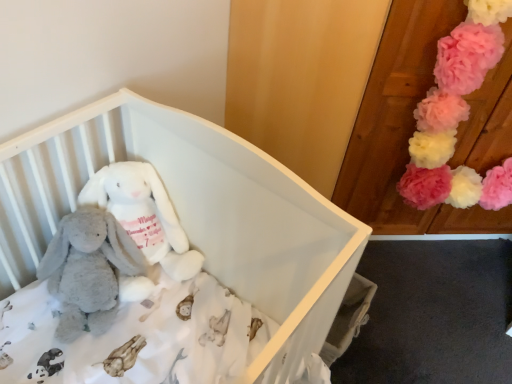
What do you see at coordinates (88, 270) in the screenshot? The width and height of the screenshot is (512, 384). I see `soft gray plush at center, which appears as the third toy when viewed from the right` at bounding box center [88, 270].

What is the approximate width of soft gray plush at center, which appears as the third toy when viewed from the right?

soft gray plush at center, which appears as the third toy when viewed from the right, is 8.77 inches in width.

Where is `fluffy pink pom-poms at upper right, which is the third toy from left to right`? Image resolution: width=512 pixels, height=384 pixels. fluffy pink pom-poms at upper right, which is the third toy from left to right is located at coordinates (457, 116).

At what (x,y) coordinates should I click in order to perform the action: click on soft gray plush at center, the 1th toy in the left-to-right sequence. Please return your answer as a coordinate pair (x, y). Looking at the image, I should click on (88, 270).

Is the position of soft gray plush at center, the 1th toy in the left-to-right sequence, more distant than that of white plush infant bed at center?

Yes.

How much distance is there between soft gray plush at center, the 1th toy in the left-to-right sequence, and white plush infant bed at center?

10.15 inches.

Is soft gray plush at center, which appears as the third toy when viewed from the right, looking in the opposite direction of white plush infant bed at center?

Yes, soft gray plush at center, which appears as the third toy when viewed from the right, is positioned with its back facing white plush infant bed at center.

How different are the orientations of soft gray plush at center, which appears as the third toy when viewed from the right, and white plush infant bed at center in degrees?

The facing directions of soft gray plush at center, which appears as the third toy when viewed from the right, and white plush infant bed at center are 0.000959 degrees apart.

Identify the location of toy on the left of soft plush bunny at center, which is the 2th toy from right to left. This screenshot has width=512, height=384. (88, 270).

In the scene shown: Can you confirm if soft plush bunny at center, placed as the 2th toy when sorted from left to right, is shorter than soft gray plush at center, the 1th toy in the left-to-right sequence?

Incorrect, the height of soft plush bunny at center, placed as the 2th toy when sorted from left to right, does not fall short of that of soft gray plush at center, the 1th toy in the left-to-right sequence.

Considering the relative sizes of soft plush bunny at center, which is the 2th toy from right to left, and soft gray plush at center, the 1th toy in the left-to-right sequence, in the image provided, is soft plush bunny at center, which is the 2th toy from right to left, smaller than soft gray plush at center, the 1th toy in the left-to-right sequence,?

Indeed, soft plush bunny at center, which is the 2th toy from right to left, has a smaller size compared to soft gray plush at center, the 1th toy in the left-to-right sequence.

From a real-world perspective, is soft plush bunny at center, which is the 2th toy from right to left, positioned above or below soft gray plush at center, which appears as the third toy when viewed from the right?

soft plush bunny at center, which is the 2th toy from right to left, is above soft gray plush at center, which appears as the third toy when viewed from the right.

Is soft gray plush at center, which appears as the third toy when viewed from the right, aimed at fluffy pink pom-poms at upper right, which is the third toy from left to right?

No, soft gray plush at center, which appears as the third toy when viewed from the right, is not oriented towards fluffy pink pom-poms at upper right, which is the third toy from left to right.

Is soft gray plush at center, which appears as the third toy when viewed from the right, bigger than fluffy pink pom-poms at upper right, which is the third toy from left to right?

No.

Is the position of soft gray plush at center, which appears as the third toy when viewed from the right, less distant than that of fluffy pink pom-poms at upper right, placed as the first toy when sorted from right to left?

Yes.

Which of these two, white plush infant bed at center or fluffy pink pom-poms at upper right, placed as the first toy when sorted from right to left, is wider?

Wider between the two is white plush infant bed at center.

Is white plush infant bed at center aimed at fluffy pink pom-poms at upper right, placed as the first toy when sorted from right to left?

No, white plush infant bed at center is not facing towards fluffy pink pom-poms at upper right, placed as the first toy when sorted from right to left.

Looking at this image, is white plush infant bed at center bigger or smaller than fluffy pink pom-poms at upper right, placed as the first toy when sorted from right to left?

Clearly, white plush infant bed at center is larger in size than fluffy pink pom-poms at upper right, placed as the first toy when sorted from right to left.

Considering the points (262, 275) and (480, 58), which point is behind, point (262, 275) or point (480, 58)?

The point (480, 58) is farther.

From the image's perspective, is fluffy pink pom-poms at upper right, placed as the first toy when sorted from right to left, positioned above or below white plush infant bed at center?

Clearly, from the image's perspective, fluffy pink pom-poms at upper right, placed as the first toy when sorted from right to left, is above white plush infant bed at center.

Which of these two, fluffy pink pom-poms at upper right, which is the third toy from left to right, or white plush infant bed at center, stands taller?

Standing taller between the two is white plush infant bed at center.

Would you consider fluffy pink pom-poms at upper right, which is the third toy from left to right, to be distant from white plush infant bed at center?

No, fluffy pink pom-poms at upper right, which is the third toy from left to right, is not far away from white plush infant bed at center.

Between fluffy pink pom-poms at upper right, placed as the first toy when sorted from right to left, and white plush infant bed at center, which one appears on the right side from the viewer's perspective?

fluffy pink pom-poms at upper right, placed as the first toy when sorted from right to left, is more to the right.

Does soft plush bunny at center, placed as the 2th toy when sorted from left to right, turn towards white plush infant bed at center?

Yes, soft plush bunny at center, placed as the 2th toy when sorted from left to right, is oriented towards white plush infant bed at center.

Between soft plush bunny at center, which is the 2th toy from right to left, and white plush infant bed at center, which one has larger width?

Wider between the two is white plush infant bed at center.

Relative to white plush infant bed at center, is soft plush bunny at center, placed as the 2th toy when sorted from left to right, in front or behind?

soft plush bunny at center, placed as the 2th toy when sorted from left to right, is behind white plush infant bed at center.

In the image, is soft plush bunny at center, placed as the 2th toy when sorted from left to right, on the left side or the right side of white plush infant bed at center?

soft plush bunny at center, placed as the 2th toy when sorted from left to right, is to the left of white plush infant bed at center.

Which is behind, point (410, 182) or point (73, 242)?

The point (410, 182) is farther from the camera.

Are fluffy pink pom-poms at upper right, placed as the first toy when sorted from right to left, and soft gray plush at center, which appears as the third toy when viewed from the right, far apart?

Yes.

Considering the positions of objects fluffy pink pom-poms at upper right, which is the third toy from left to right, and soft gray plush at center, the 1th toy in the left-to-right sequence, in the image provided, who is behind, fluffy pink pom-poms at upper right, which is the third toy from left to right, or soft gray plush at center, the 1th toy in the left-to-right sequence,?

Positioned behind is fluffy pink pom-poms at upper right, which is the third toy from left to right.

This screenshot has width=512, height=384. What are the coordinates of `infant bed that is in front of the soft gray plush at center, which appears as the third toy when viewed from the right` in the screenshot? It's located at (196, 212).

Identify the location of the 1st toy to the right when counting from the soft gray plush at center, the 1th toy in the left-to-right sequence. This screenshot has height=384, width=512. (144, 215).

Which object lies nearer to the anchor point soft gray plush at center, the 1th toy in the left-to-right sequence, soft plush bunny at center, placed as the 2th toy when sorted from left to right, or white plush infant bed at center?

soft plush bunny at center, placed as the 2th toy when sorted from left to right, lies closer to soft gray plush at center, the 1th toy in the left-to-right sequence, than the other object.

From the image, which object appears to be farther from soft plush bunny at center, placed as the 2th toy when sorted from left to right, white plush infant bed at center or fluffy pink pom-poms at upper right, placed as the first toy when sorted from right to left?

fluffy pink pom-poms at upper right, placed as the first toy when sorted from right to left, is further to soft plush bunny at center, placed as the 2th toy when sorted from left to right.

Looking at the image, which one is located further to soft plush bunny at center, which is the 2th toy from right to left, white plush infant bed at center or soft gray plush at center, which appears as the third toy when viewed from the right?

Based on the image, white plush infant bed at center appears to be further to soft plush bunny at center, which is the 2th toy from right to left.

Estimate the real-world distances between objects in this image. Which object is closer to soft gray plush at center, which appears as the third toy when viewed from the right, white plush infant bed at center or soft plush bunny at center, which is the 2th toy from right to left?

The object closer to soft gray plush at center, which appears as the third toy when viewed from the right, is soft plush bunny at center, which is the 2th toy from right to left.

From the image, which object appears to be farther from fluffy pink pom-poms at upper right, placed as the first toy when sorted from right to left, soft plush bunny at center, placed as the 2th toy when sorted from left to right, or white plush infant bed at center?

soft plush bunny at center, placed as the 2th toy when sorted from left to right.

Estimate the real-world distances between objects in this image. Which object is closer to white plush infant bed at center, soft gray plush at center, the 1th toy in the left-to-right sequence, or fluffy pink pom-poms at upper right, placed as the first toy when sorted from right to left?

soft gray plush at center, the 1th toy in the left-to-right sequence.

Estimate the real-world distances between objects in this image. Which object is further from soft gray plush at center, the 1th toy in the left-to-right sequence, fluffy pink pom-poms at upper right, placed as the first toy when sorted from right to left, or soft plush bunny at center, which is the 2th toy from right to left?

Among the two, fluffy pink pom-poms at upper right, placed as the first toy when sorted from right to left, is located further to soft gray plush at center, the 1th toy in the left-to-right sequence.

Considering their positions, is soft gray plush at center, which appears as the third toy when viewed from the right, positioned closer to soft plush bunny at center, which is the 2th toy from right to left, than fluffy pink pom-poms at upper right, which is the third toy from left to right?

Based on the image, soft gray plush at center, which appears as the third toy when viewed from the right, appears to be nearer to soft plush bunny at center, which is the 2th toy from right to left.

Where is `infant bed between soft gray plush at center, the 1th toy in the left-to-right sequence, and fluffy pink pom-poms at upper right, which is the third toy from left to right, from left to right`? The width and height of the screenshot is (512, 384). infant bed between soft gray plush at center, the 1th toy in the left-to-right sequence, and fluffy pink pom-poms at upper right, which is the third toy from left to right, from left to right is located at coordinates (196, 212).

The height and width of the screenshot is (384, 512). Identify the location of toy located between white plush infant bed at center and soft plush bunny at center, placed as the 2th toy when sorted from left to right, in the depth direction. (88, 270).

Identify the location of infant bed located between soft plush bunny at center, which is the 2th toy from right to left, and fluffy pink pom-poms at upper right, placed as the first toy when sorted from right to left, in the left-right direction. The height and width of the screenshot is (384, 512). (196, 212).

The image size is (512, 384). Find the location of `toy between soft gray plush at center, the 1th toy in the left-to-right sequence, and fluffy pink pom-poms at upper right, placed as the first toy when sorted from right to left`. toy between soft gray plush at center, the 1th toy in the left-to-right sequence, and fluffy pink pom-poms at upper right, placed as the first toy when sorted from right to left is located at coordinates (144, 215).